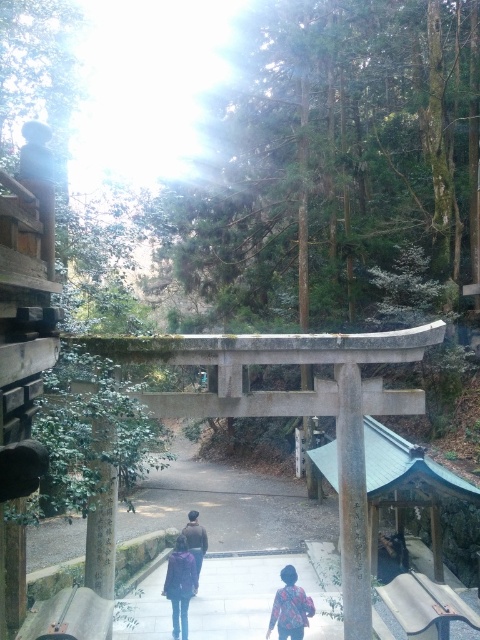
Question: In this image, where is smooth stone path at center located relative to floral-patterned shirt at lower center?

Choices:
 (A) above
 (B) below

Answer: (B)

Question: Which is nearer to the smooth stone path at center?

Choices:
 (A) floral-patterned shirt at lower center
 (B) dark brown leather jacket at center
 (C) smooth gray stone torii gate at center
 (D) matte purple backpack at center

Answer: (D)

Question: Can you confirm if floral-patterned shirt at lower center is positioned to the left of dark brown leather jacket at center?

Choices:
 (A) no
 (B) yes

Answer: (A)

Question: Which object is closer to the camera taking this photo?

Choices:
 (A) dark brown leather jacket at center
 (B) matte purple backpack at center

Answer: (B)

Question: Which is farther from the smooth gray stone torii gate at center?

Choices:
 (A) floral-patterned shirt at lower center
 (B) dark brown leather jacket at center

Answer: (B)

Question: Is smooth gray stone torii gate at center wider than dark brown leather jacket at center?

Choices:
 (A) yes
 (B) no

Answer: (B)